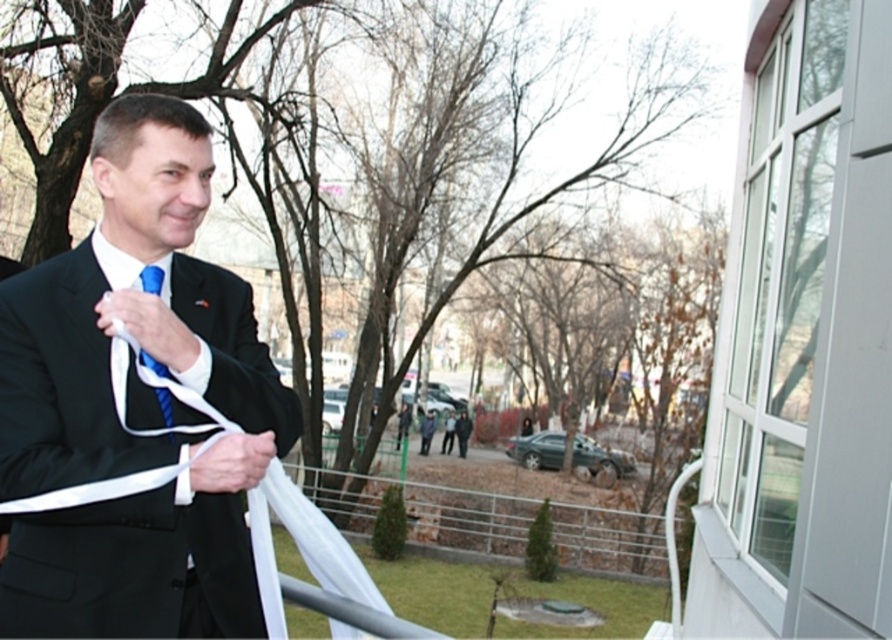
Question: In this image, where is matte black suit at center located relative to blue textured tie at center?

Choices:
 (A) left
 (B) right

Answer: (A)

Question: Is matte black suit at center in front of blue textured tie at center?

Choices:
 (A) no
 (B) yes

Answer: (B)

Question: Which point is farther from the camera taking this photo?

Choices:
 (A) (157, 294)
 (B) (117, 253)

Answer: (B)

Question: Which of the following is the farthest from the observer?

Choices:
 (A) (141, 337)
 (B) (170, 397)

Answer: (B)

Question: Among these points, which one is nearest to the camera?

Choices:
 (A) (87, 403)
 (B) (162, 387)

Answer: (A)

Question: Is matte black suit at center above blue textured tie at center?

Choices:
 (A) yes
 (B) no

Answer: (B)